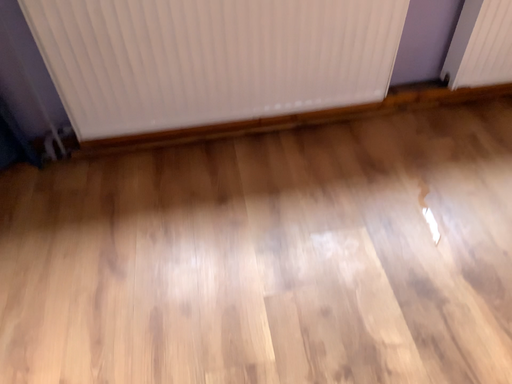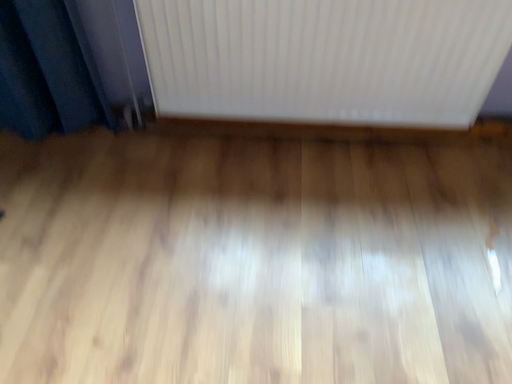
Question: Which way did the camera rotate in the video?

Choices:
 (A) rotated left
 (B) rotated right

Answer: (A)